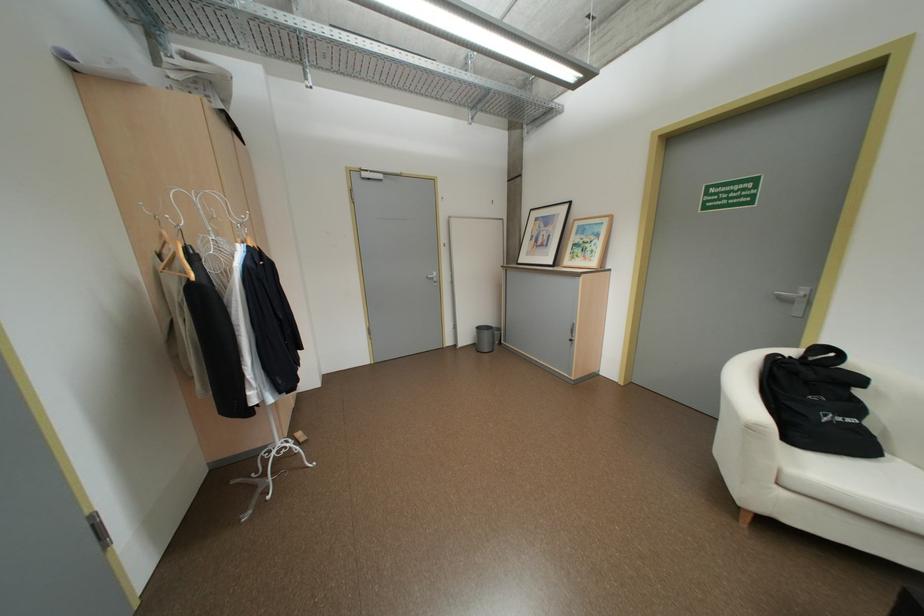
What do you see at coordinates (845, 467) in the screenshot? This screenshot has height=616, width=924. I see `the sofa sitting surface` at bounding box center [845, 467].